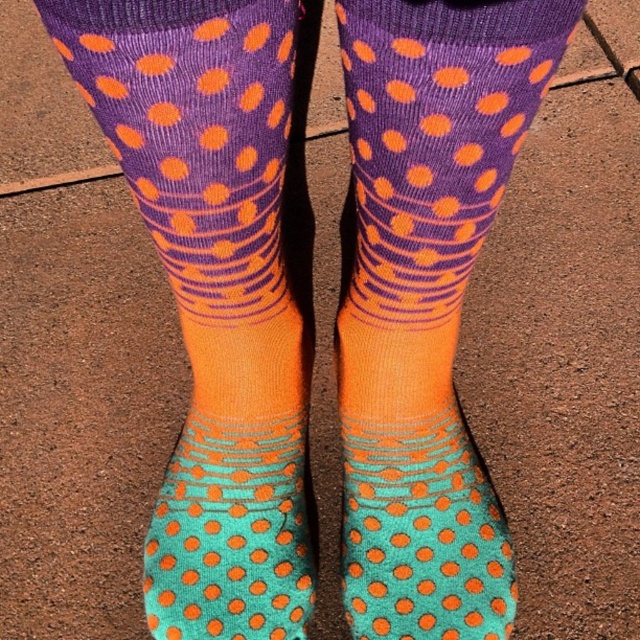
Question: Which point is farther from the camera taking this photo?

Choices:
 (A) (268, 477)
 (B) (352, 564)

Answer: (A)

Question: Observing the image, what is the correct spatial positioning of teal matte socks at center in reference to teal dotted socks at center?

Choices:
 (A) above
 (B) below

Answer: (A)

Question: Does orange dotted socks at center appear over teal dotted socks at center?

Choices:
 (A) yes
 (B) no

Answer: (A)

Question: Which of the following is the closest to the observer?

Choices:
 (A) (476, 538)
 (B) (272, 628)
 (C) (557, 33)

Answer: (C)

Question: Which object is closer to the camera taking this photo?

Choices:
 (A) orange dotted socks at center
 (B) teal matte socks at center
 (C) teal dotted socks at center
 (D) matte purple socks at center

Answer: (A)

Question: Can you confirm if orange dotted socks at center is positioned to the right of teal dotted socks at center?

Choices:
 (A) yes
 (B) no

Answer: (A)